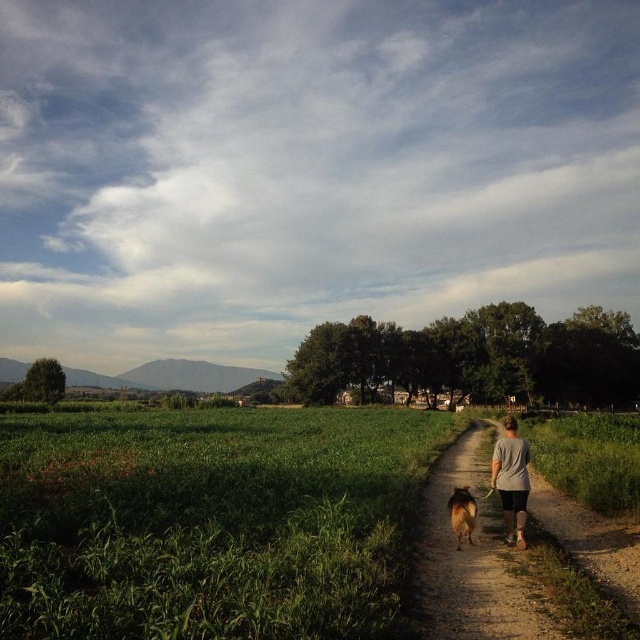
Question: Which point is farther to the camera?

Choices:
 (A) (522, 484)
 (B) (545, 568)
 (C) (461, 516)

Answer: (A)

Question: Is gray fabric shirt at center in front of brown furry dog at center?

Choices:
 (A) no
 (B) yes

Answer: (A)

Question: Among these objects, which one is nearest to the camera?

Choices:
 (A) brown furry dog at center
 (B) gray fabric shirt at center
 (C) dirt path at center

Answer: (C)

Question: Can you confirm if gray fabric shirt at center is positioned to the left of brown furry dog at center?

Choices:
 (A) yes
 (B) no

Answer: (B)

Question: Which point appears closest to the camera in this image?

Choices:
 (A) (440, 563)
 (B) (468, 529)

Answer: (A)

Question: Is dirt path at center above gray fabric shirt at center?

Choices:
 (A) no
 (B) yes

Answer: (A)